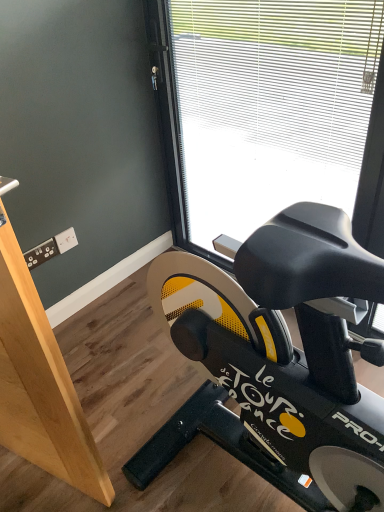
Locate an element on the screen. This screenshot has height=512, width=384. vacant point to the right of light brown wood at left is located at coordinates (150, 438).